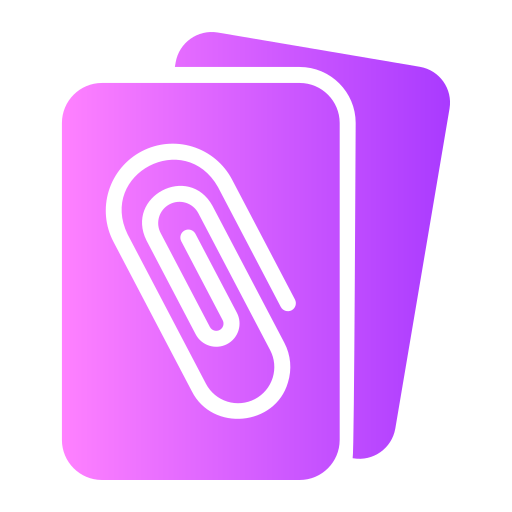
Locate an element on the screen. rounded corners is located at coordinates (324, 462), (72, 466), (379, 446), (86, 95), (320, 102), (339, 91), (433, 90), (204, 42).